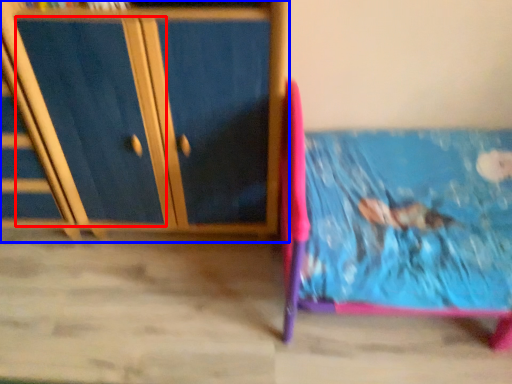
Question: Which of the following is the farthest to the observer, drawer (highlighted by a red box) or furniture (highlighted by a blue box)?

Choices:
 (A) drawer
 (B) furniture

Answer: (A)